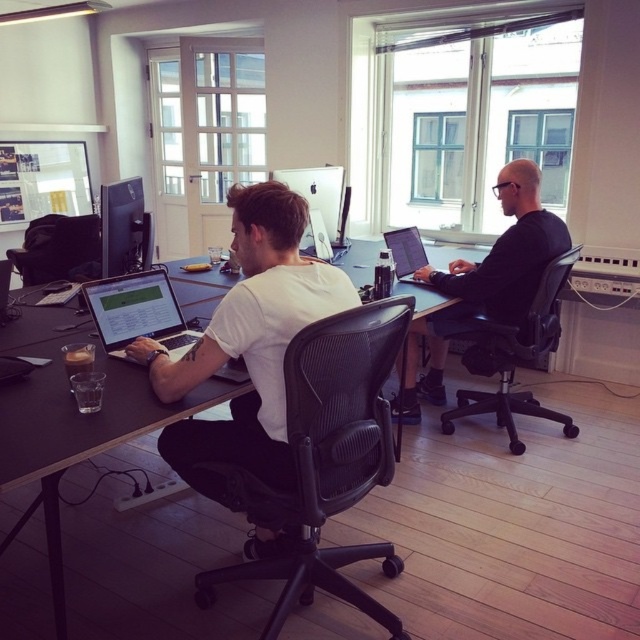
Does black plastic desk at center appear over matte black laptop at left?

No.

Can you confirm if black plastic desk at center is smaller than matte black laptop at left?

Actually, black plastic desk at center might be larger than matte black laptop at left.

Does point (145, 378) come closer to viewer compared to point (104, 282)?

That is True.

At what (x,y) coordinates should I click in order to perform the action: click on black plastic desk at center. Please return your answer as a coordinate pair (x, y). This screenshot has width=640, height=640. Looking at the image, I should click on (92, 499).

Who is higher up, black mesh swivel chair at center or matte black laptop at left?

matte black laptop at left is above.

Who is taller, black mesh swivel chair at center or matte black laptop at left?

Standing taller between the two is black mesh swivel chair at center.

Does point (307, 580) come farther from viewer compared to point (173, 316)?

No.

At what (x,y) coordinates should I click in order to perform the action: click on black mesh swivel chair at center. Please return your answer as a coordinate pair (x, y). This screenshot has width=640, height=640. Looking at the image, I should click on (326, 460).

How distant is matte black laptop at left from matte black monitor at upper left?

matte black laptop at left and matte black monitor at upper left are 24.05 inches apart from each other.

Where is `matte black laptop at left`? The width and height of the screenshot is (640, 640). matte black laptop at left is located at coordinates (138, 312).

You are a GUI agent. You are given a task and a screenshot of the screen. Output one action in this format:
    pyautogui.click(x=<x>, y=<y>)
    Task: Click on the matte black laptop at left
    The width and height of the screenshot is (640, 640).
    Given the screenshot: What is the action you would take?
    pyautogui.click(x=138, y=312)